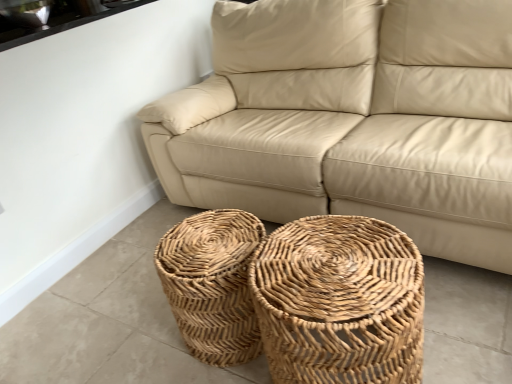
You are a GUI agent. You are given a task and a screenshot of the screen. Output one action in this format:
    pyautogui.click(x=<x>, y=<y>)
    Task: Click on the free space above natural woven baskets at center, the 2th basket in the right-to-left sequence (from a real-world perspective)
    This screenshot has height=384, width=512.
    Given the screenshot: What is the action you would take?
    pyautogui.click(x=207, y=245)